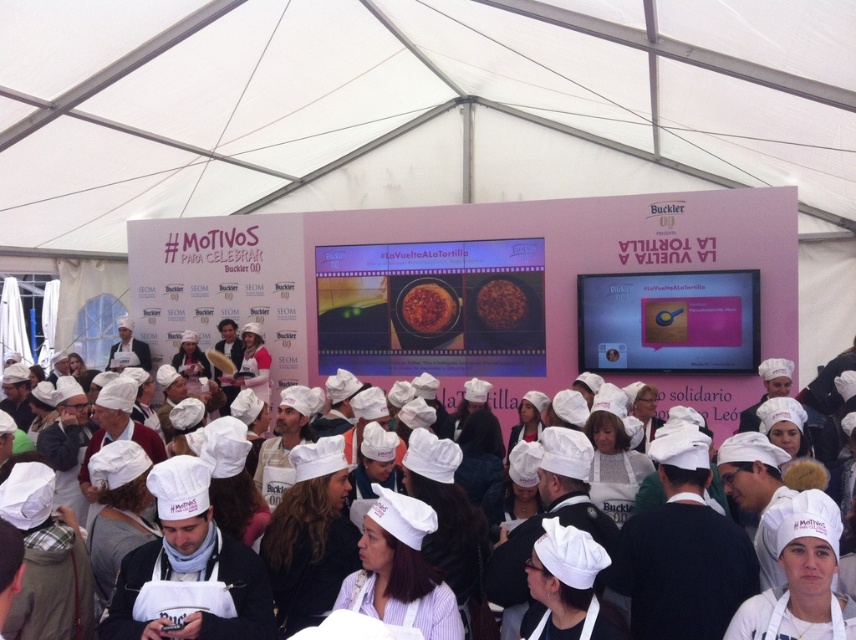
Question: Is white fabric chef hat at center thinner than brown matte tortilla at center?

Choices:
 (A) no
 (B) yes

Answer: (A)

Question: Among these points, which one is farthest from the camera?

Choices:
 (A) (485, 307)
 (B) (669, 552)
 (C) (116, 236)
 (D) (417, 310)

Answer: (C)

Question: Which point is closer to the camera?

Choices:
 (A) white fabric chef hat at center
 (B) white fabric canopy at upper center
 (C) brown matte rice at center
 (D) brown matte tortilla at center

Answer: (A)

Question: Does white fabric canopy at upper center appear on the left side of brown matte tortilla at center?

Choices:
 (A) yes
 (B) no

Answer: (A)

Question: Which is farther from the brown matte rice at center?

Choices:
 (A) brown matte tortilla at center
 (B) white fabric canopy at upper center
 (C) white fabric chef hat at center

Answer: (C)

Question: Is brown matte tortilla at center wider than brown matte rice at center?

Choices:
 (A) no
 (B) yes

Answer: (B)